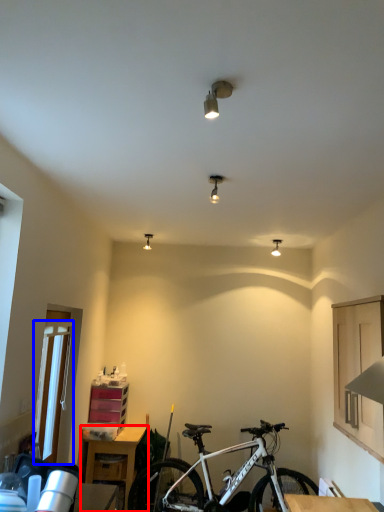
Question: Which object appears farthest to the camera in this image, table (highlighted by a red box) or glass door (highlighted by a blue box)?

Choices:
 (A) table
 (B) glass door

Answer: (A)